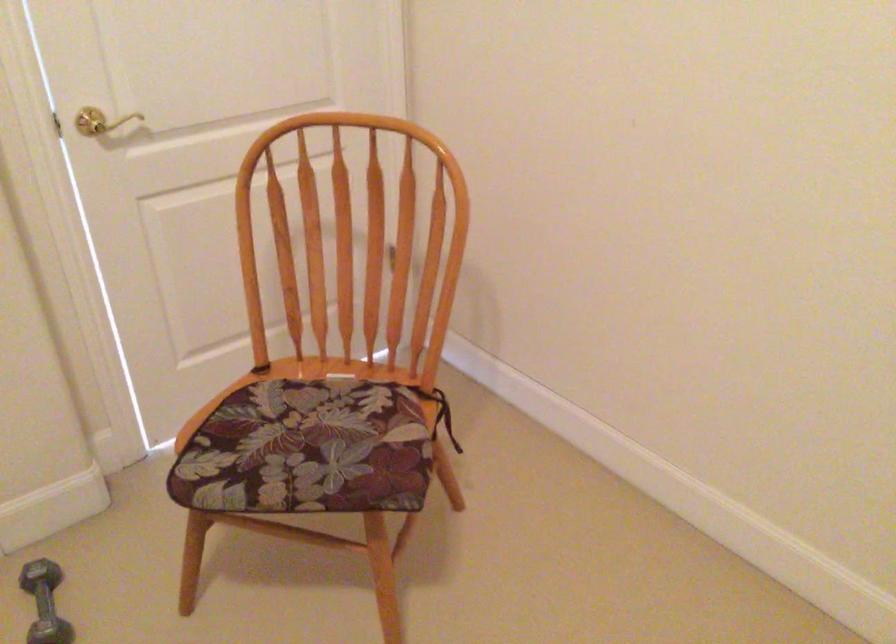
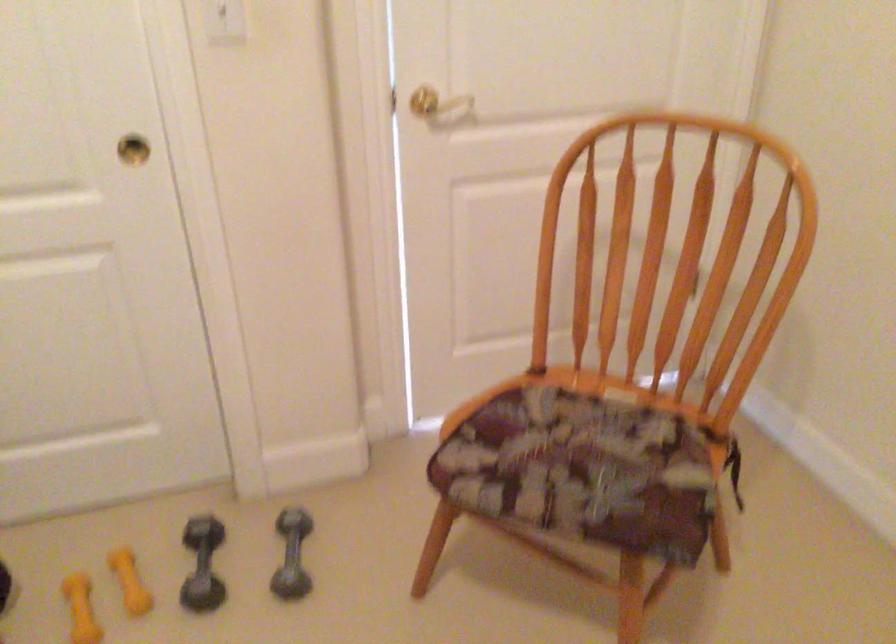
In the second image, find the point that corresponds to point 316,451 in the first image.

(582, 469)